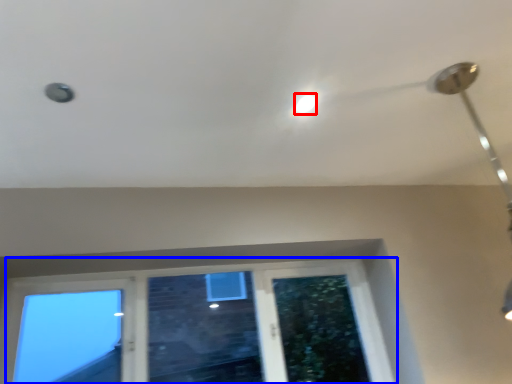
Question: Which point is closer to the camera, droplight (highlighted by a red box) or window (highlighted by a blue box)?

Choices:
 (A) droplight
 (B) window

Answer: (A)